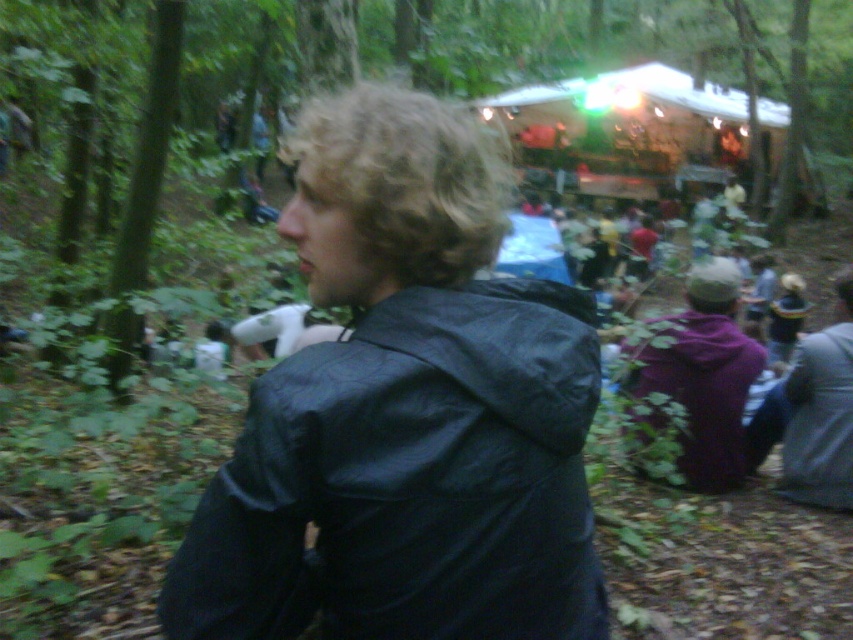
You are a photographer at the event and want to capture a photo that includes both the curly blonde hair at upper left and the purple fleece jacket at lower right. Based on their positions, which object should you place on the left side of your camera frame?

The curly blonde hair at upper left should be placed on the left side of your camera frame because it is positioned on the left side of the purple fleece jacket at lower right.

You are standing at the center of the scene and want to locate the curly blonde hair at upper left. According to the coordinates provided, in which direction should you look?

The curly blonde hair at upper left is located at coordinates point (x=409, y=177), which means you should look towards the upper left direction to find it.

You are a photographer trying to capture the scene. You notice the curly blonde hair at upper left and the shiny gold hat at center. Which object should you zoom in on if you want to focus on the wider one?

The curly blonde hair at upper left is wider than the shiny gold hat at center, so you should zoom in on the curly blonde hair at upper left.